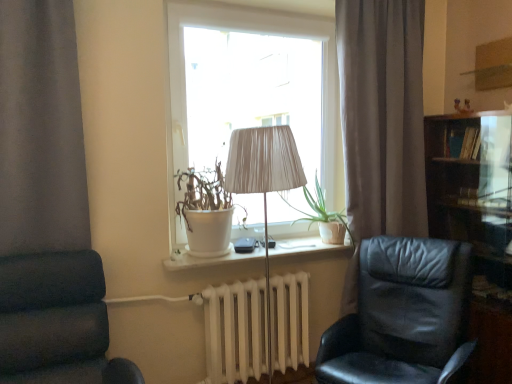
Question: Would you say white matte pot at window is to the left or to the right of white ceramic window sill at center in the picture?

Choices:
 (A) left
 (B) right

Answer: (A)

Question: Is white matte pot at window wider or thinner than white ceramic window sill at center?

Choices:
 (A) thin
 (B) wide

Answer: (A)

Question: Which is farther from the green matte plant at center?

Choices:
 (A) dark wood bookshelf at right
 (B) matte white lamp at center
 (C) white matte radiator at center
 (D) gray fabric curtain at center
 (E) black leather chair at right, which appears as the 2th chair when viewed from the left

Answer: (A)

Question: Which is farther from the green matte plant at center?

Choices:
 (A) white ceramic window sill at center
 (B) white matte radiator at center
 (C) dark blue fabric chair at left, which is the 2th chair in right-to-left order
 (D) matte white lamp at center
 (E) dark wood bookshelf at right

Answer: (C)